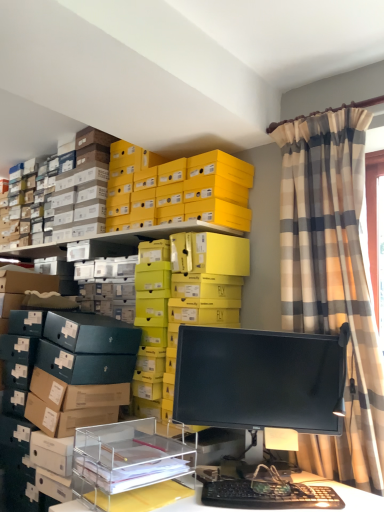
Question: Can you confirm if plaid fabric curtain at upper right is taller than black plastic keyboard at lower center?

Choices:
 (A) no
 (B) yes

Answer: (B)

Question: Does plaid fabric curtain at upper right have a smaller size compared to black plastic keyboard at lower center?

Choices:
 (A) no
 (B) yes

Answer: (A)

Question: From a real-world perspective, is plaid fabric curtain at upper right on black plastic keyboard at lower center?

Choices:
 (A) no
 (B) yes

Answer: (B)

Question: Is plaid fabric curtain at upper right turned away from black plastic keyboard at lower center?

Choices:
 (A) no
 (B) yes

Answer: (A)

Question: Does plaid fabric curtain at upper right turn towards black plastic keyboard at lower center?

Choices:
 (A) yes
 (B) no

Answer: (A)

Question: Would you say black plastic keyboard at lower center is part of plaid fabric curtain at upper right's contents?

Choices:
 (A) yes
 (B) no

Answer: (B)

Question: Is yellow cardboard boxes at upper center, the second shelf viewed from the front, oriented away from clear acrylic organizer at lower center, the 2th shelf when ordered from back to front?

Choices:
 (A) no
 (B) yes

Answer: (A)

Question: Does yellow cardboard boxes at upper center, the second shelf viewed from the front, contain clear acrylic organizer at lower center, which is counted as the first shelf, starting from the front?

Choices:
 (A) yes
 (B) no

Answer: (B)

Question: Could you tell me if yellow cardboard boxes at upper center, the 1th shelf positioned from the back, is turned towards clear acrylic organizer at lower center, which is counted as the first shelf, starting from the front?

Choices:
 (A) yes
 (B) no

Answer: (A)

Question: Can you see yellow cardboard boxes at upper center, the second shelf viewed from the front, touching clear acrylic organizer at lower center, the 2th shelf when ordered from back to front?

Choices:
 (A) yes
 (B) no

Answer: (B)

Question: From the image's perspective, is yellow cardboard boxes at upper center, the 1th shelf positioned from the back, located beneath clear acrylic organizer at lower center, which is counted as the first shelf, starting from the front?

Choices:
 (A) no
 (B) yes

Answer: (A)

Question: Is the position of yellow cardboard boxes at upper center, the 1th shelf positioned from the back, more distant than that of clear acrylic organizer at lower center, which is counted as the first shelf, starting from the front?

Choices:
 (A) no
 (B) yes

Answer: (B)

Question: From the image's perspective, is yellow cardboard boxes at upper center, the 1th shelf positioned from the back, located beneath yellow matte shoebox at upper center?

Choices:
 (A) yes
 (B) no

Answer: (A)